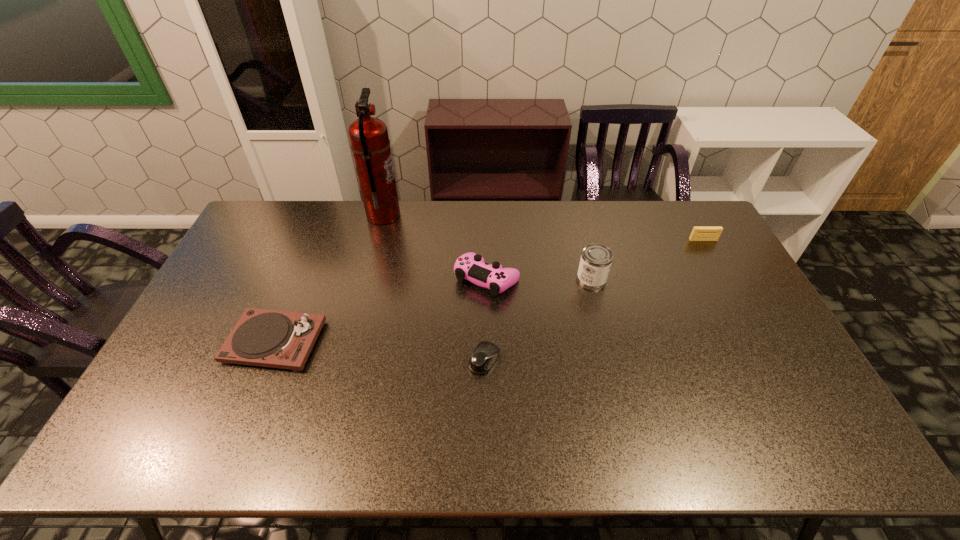
You are a GUI agent. You are given a task and a screenshot of the screen. Output one action in this format:
    pyautogui.click(x=<x>, y=<y>)
    Task: Click on the vacant point located between the second farthest object and the phonograph_record
    The width and height of the screenshot is (960, 540).
    Given the screenshot: What is the action you would take?
    pyautogui.click(x=489, y=291)

Where is `vacant region between the mouse and the fifth object from right to left`? Image resolution: width=960 pixels, height=540 pixels. vacant region between the mouse and the fifth object from right to left is located at coordinates (x=434, y=288).

The height and width of the screenshot is (540, 960). I want to click on empty location between the phonograph_record and the mouse, so click(379, 351).

The image size is (960, 540). What are the coordinates of `vacant point located between the fifth nearest object and the fifth object from left to right` in the screenshot? It's located at (647, 260).

Locate an element on the screen. This screenshot has height=540, width=960. free spot between the fire extinguisher and the mouse is located at coordinates (434, 288).

You are a GUI agent. You are given a task and a screenshot of the screen. Output one action in this format:
    pyautogui.click(x=<x>, y=<y>)
    Task: Click on the object that is the nearest to the control
    This screenshot has height=540, width=960.
    Given the screenshot: What is the action you would take?
    pyautogui.click(x=486, y=353)

Find the location of `object that ranks as the closest to the fifth object from right to left`. object that ranks as the closest to the fifth object from right to left is located at coordinates (470, 266).

Locate an element on the screen. The width and height of the screenshot is (960, 540). free spot that satisfies the following two spatial constraints: 1. on the nozzle side of the tallest object; 2. on the left side of the shortest object is located at coordinates (347, 360).

What are the coordinates of `free spot that satisfies the following two spatial constraints: 1. on the nozzle side of the fifth object from right to left; 2. on the right side of the mouse` in the screenshot? It's located at (347, 360).

In order to click on blank space that satisfies the following two spatial constraints: 1. on the back side of the mouse; 2. on the left side of the third tallest object in this screenshot , I will do `click(484, 279)`.